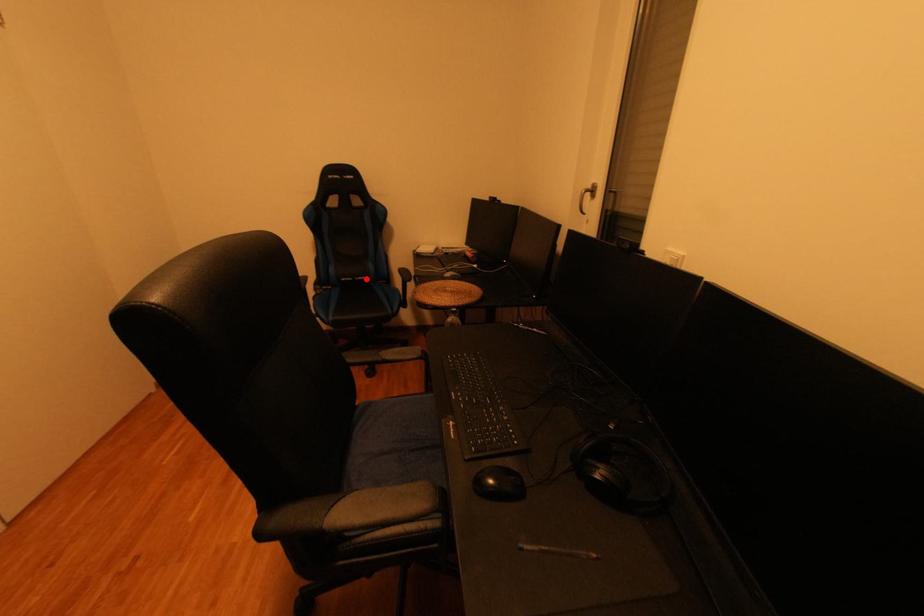
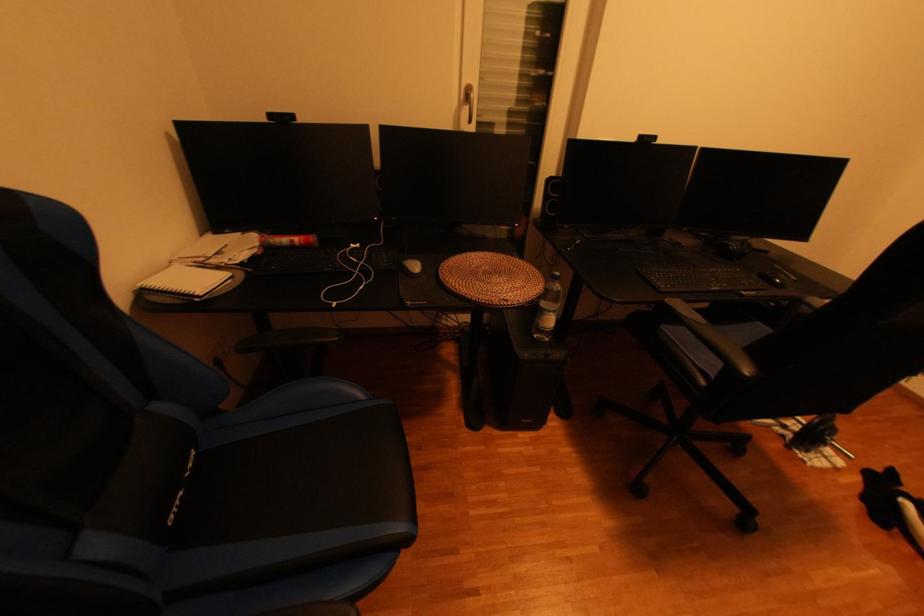
Question: I am providing you with two images of the same scene from different viewpoints. A red point is shown in image1. For the corresponding object point in image2, is it positioned nearer or farther from the camera?

Choices:
 (A) Nearer
 (B) Farther

Answer: (B)